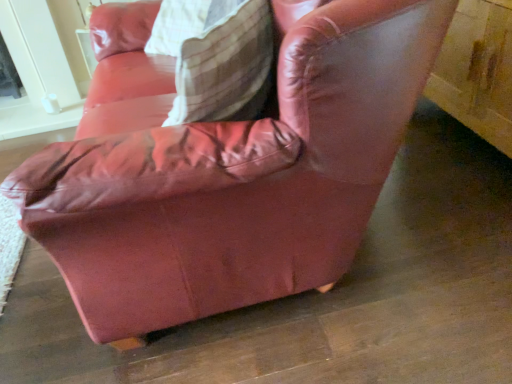
This screenshot has height=384, width=512. What do you see at coordinates (225, 65) in the screenshot? I see `striped fabric pillow at upper center` at bounding box center [225, 65].

Locate an element on the screen. This screenshot has width=512, height=384. striped fabric pillow at upper center is located at coordinates (225, 65).

The height and width of the screenshot is (384, 512). I want to click on striped fabric pillow at upper center, so click(x=225, y=65).